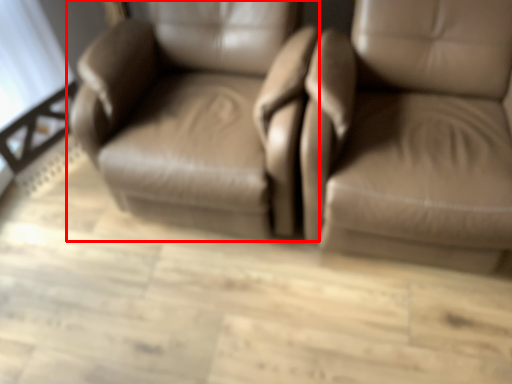
Question: From the image's perspective, where is chair (annotated by the red box) located in relation to chair in the image?

Choices:
 (A) above
 (B) below

Answer: (A)